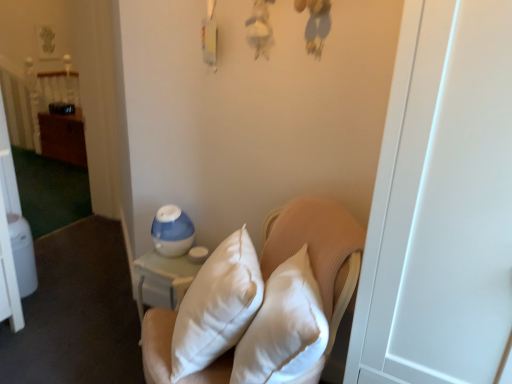
Question: Is wooden bed at left at the left side of white quilted pillows at center?

Choices:
 (A) yes
 (B) no

Answer: (A)

Question: Is wooden bed at left far away from white quilted pillows at center?

Choices:
 (A) yes
 (B) no

Answer: (A)

Question: Is wooden bed at left wider than white quilted pillows at center?

Choices:
 (A) no
 (B) yes

Answer: (A)

Question: From the image's perspective, is wooden bed at left beneath white quilted pillows at center?

Choices:
 (A) yes
 (B) no

Answer: (B)

Question: Does wooden bed at left come behind white quilted pillows at center?

Choices:
 (A) yes
 (B) no

Answer: (A)

Question: Is point (64, 158) closer or farther from the camera than point (75, 132)?

Choices:
 (A) closer
 (B) farther

Answer: (B)

Question: Based on their sizes in the image, would you say wooden dresser at left is bigger or smaller than wooden bed at left?

Choices:
 (A) big
 (B) small

Answer: (A)

Question: From their relative heights in the image, would you say wooden dresser at left is taller or shorter than wooden bed at left?

Choices:
 (A) tall
 (B) short

Answer: (B)

Question: Is wooden dresser at left wider or thinner than wooden bed at left?

Choices:
 (A) wide
 (B) thin

Answer: (A)

Question: Considering the positions of wooden dresser at left and white quilted pillows at center in the image, is wooden dresser at left taller or shorter than white quilted pillows at center?

Choices:
 (A) short
 (B) tall

Answer: (A)

Question: Considering the positions of wooden dresser at left and white quilted pillows at center in the image, is wooden dresser at left bigger or smaller than white quilted pillows at center?

Choices:
 (A) big
 (B) small

Answer: (B)

Question: Considering the positions of point (49, 142) and point (209, 372), is point (49, 142) closer or farther from the camera than point (209, 372)?

Choices:
 (A) closer
 (B) farther

Answer: (B)

Question: Do you think wooden dresser at left is within white quilted pillows at center, or outside of it?

Choices:
 (A) outside
 (B) inside

Answer: (A)

Question: In terms of size, does wooden bed at left appear bigger or smaller than white quilted pillows at center?

Choices:
 (A) small
 (B) big

Answer: (A)

Question: Considering the positions of wooden bed at left and white quilted pillows at center in the image, is wooden bed at left wider or thinner than white quilted pillows at center?

Choices:
 (A) wide
 (B) thin

Answer: (B)